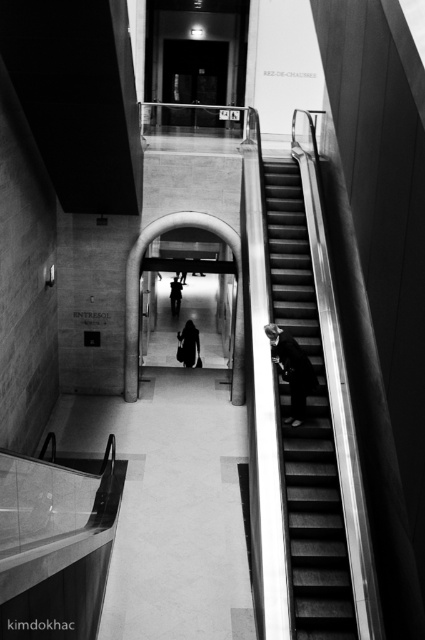
Can you confirm if dark fabric bag at center is positioned to the right of dark fabric coat at center?

Correct, you'll find dark fabric bag at center to the right of dark fabric coat at center.

The width and height of the screenshot is (425, 640). Find the location of `dark fabric bag at center`. dark fabric bag at center is located at coordinates (189, 344).

Measure the distance between dark gray suit at right and dark fabric coat at center.

The distance of dark gray suit at right from dark fabric coat at center is 43.94 feet.

Describe the element at coordinates (291, 369) in the screenshot. The width and height of the screenshot is (425, 640). I see `dark gray suit at right` at that location.

At what (x,y) coordinates should I click in order to perform the action: click on dark gray suit at right. Please return your answer as a coordinate pair (x, y). This screenshot has height=640, width=425. Looking at the image, I should click on (291, 369).

Is point (354, 620) closer to viewer compared to point (294, 339)?

That is True.

Is metallic silver stairs at right shorter than dark gray suit at right?

Correct, metallic silver stairs at right is not as tall as dark gray suit at right.

Does point (334, 502) come closer to viewer compared to point (286, 380)?

That is True.

Image resolution: width=425 pixels, height=640 pixels. I want to click on metallic silver stairs at right, so click(306, 426).